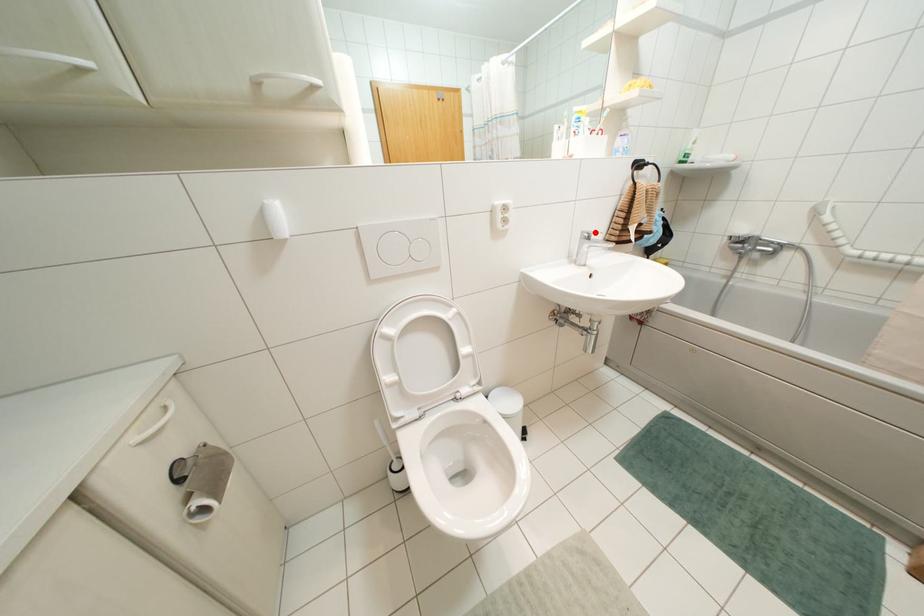
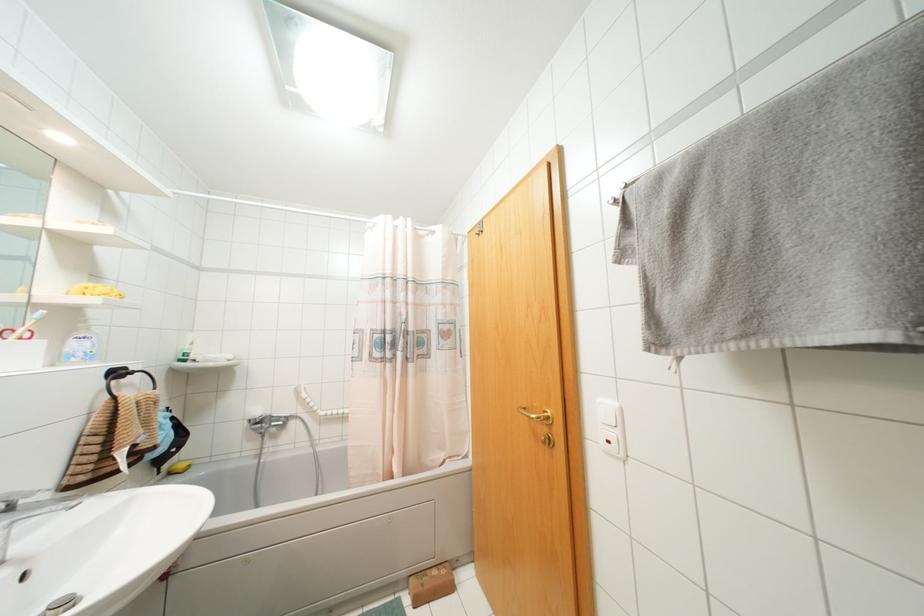
Find the pixel in the second image that matches the highlighted location in the first image.

(30, 493)